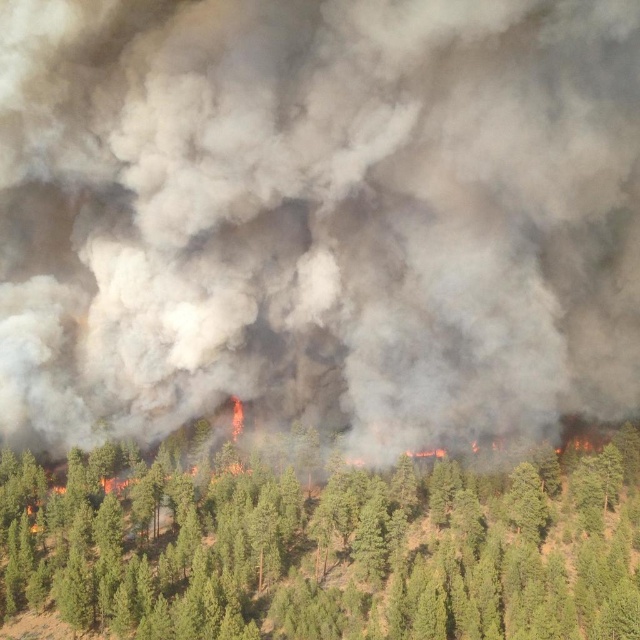
You are a firefighter assessing the situation from above. You notice the gray matte smoke at center and the green leafy tree at center. Which object is positioned higher in the air?

The gray matte smoke at center is above the green leafy tree at center, so the smoke is higher in the air.

You are a firefighter assessing the situation from above. You see the gray matte smoke at center and the green leafy tree at center. How far apart are these two elements?

The gray matte smoke at center is 27.18 meters away from the green leafy tree at center.

You are a firefighter analyzing an aerial image of a forest fire. You see two points marked in the image. Which point is closer to the fire? The points are labeled as point (163,342) and point (298,604).

Based on the coordinates and spatial relationships, point (163,342) is closer to the fire than point (298,604) because it is positioned further to the viewer, which in aerial imagery typically corresponds to being nearer to the active fire area.